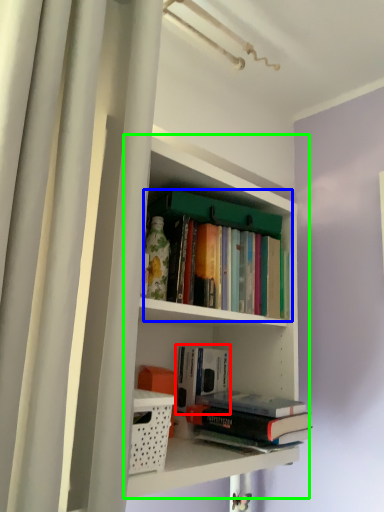
Question: Which object is the farthest from book (highlighted by a red box)? Choose among these: book (highlighted by a blue box) or shelf (highlighted by a green box).

Choices:
 (A) book
 (B) shelf

Answer: (A)